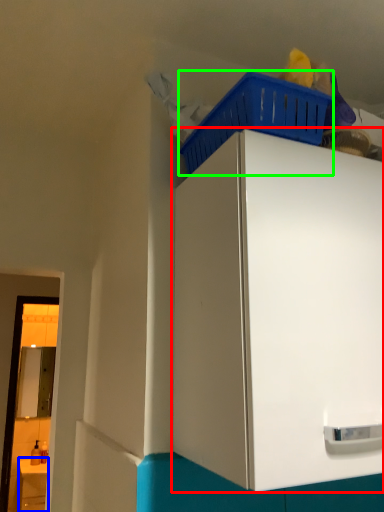
Question: Which object is positioned closest to cabinetry (highlighted by a red box)? Select from counter (highlighted by a blue box) and basket (highlighted by a green box).

Choices:
 (A) counter
 (B) basket

Answer: (B)